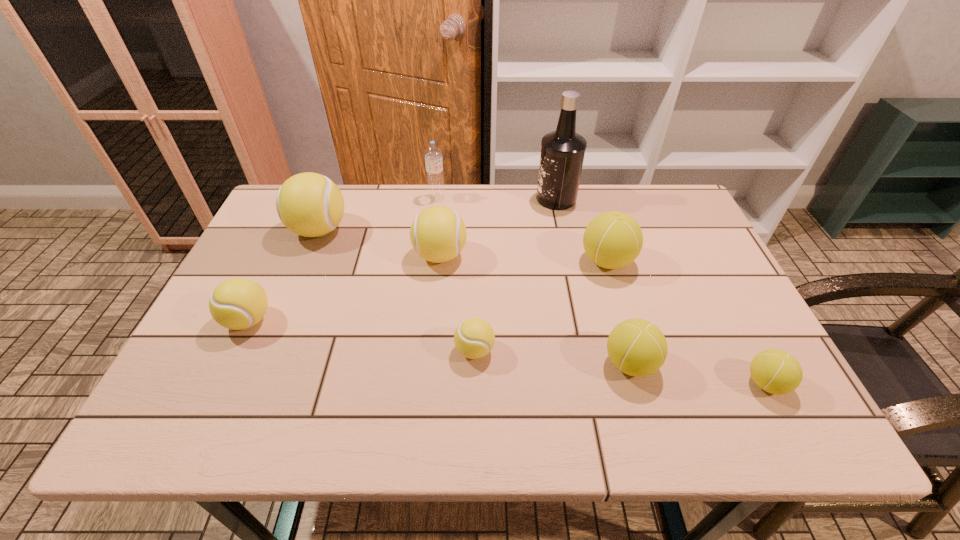
The width and height of the screenshot is (960, 540). In order to click on liquor in this screenshot , I will do `click(562, 153)`.

At what (x,y) coordinates should I click in order to perform the action: click on the tallest object. Please return your answer as a coordinate pair (x, y). Looking at the image, I should click on (562, 153).

Locate an element on the screen. This screenshot has height=540, width=960. water bottle is located at coordinates (433, 154).

Locate an element on the screen. the biggest yellow tennis ball is located at coordinates (309, 204).

In order to click on the third smallest yellow tennis ball in this screenshot , I will do `click(437, 234)`.

Where is `the biggest green tennis ball`? Image resolution: width=960 pixels, height=540 pixels. the biggest green tennis ball is located at coordinates (612, 240).

Locate an element on the screen. The width and height of the screenshot is (960, 540). the second smallest yellow tennis ball is located at coordinates (238, 303).

The height and width of the screenshot is (540, 960). I want to click on the second smallest green tennis ball, so click(x=637, y=347).

The image size is (960, 540). What are the coordinates of `the smallest yellow tennis ball` in the screenshot? It's located at (474, 338).

Locate an element on the screen. the smallest green tennis ball is located at coordinates (775, 371).